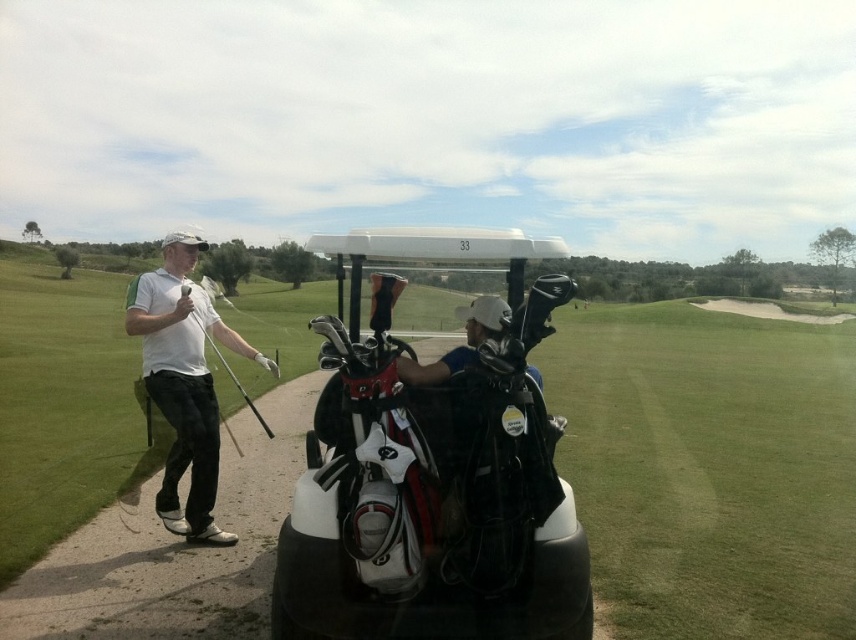
Does white matte golf club at left appear over matte black golf club at left?

Yes, white matte golf club at left is above matte black golf club at left.

Which of these two, white matte golf club at left or matte black golf club at left, stands taller?

white matte golf club at left is taller.

Does point (162, 518) lie in front of point (259, 417)?

Yes, point (162, 518) is in front of point (259, 417).

The image size is (856, 640). I want to click on white matte golf club at left, so click(183, 381).

You are a GUI agent. You are given a task and a screenshot of the screen. Output one action in this format:
    pyautogui.click(x=<x>, y=<y>)
    Task: Click on the white matte golf cart at center
    
    Given the screenshot: What is the action you would take?
    pyautogui.click(x=434, y=467)

Which is in front, point (288, 604) or point (209, 337)?

Point (288, 604)

Who is more distant from viewer, (407, 627) or (188, 291)?

Point (188, 291)

Find the location of a particular element. white matte golf cart at center is located at coordinates (434, 467).

Is green grass golf course at center to the right of white matte golf cart at center from the viewer's perspective?

No, green grass golf course at center is not to the right of white matte golf cart at center.

Can you confirm if green grass golf course at center is positioned to the left of white matte golf cart at center?

Yes, green grass golf course at center is to the left of white matte golf cart at center.

Image resolution: width=856 pixels, height=640 pixels. Describe the element at coordinates (709, 468) in the screenshot. I see `green grass golf course at center` at that location.

Find the location of `green grass golf course at center`. green grass golf course at center is located at coordinates (709, 468).